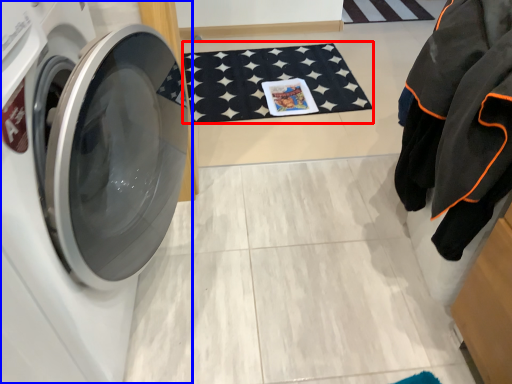
Question: Among these objects, which one is farthest to the camera, bath mat (highlighted by a red box) or washing machine (highlighted by a blue box)?

Choices:
 (A) bath mat
 (B) washing machine

Answer: (A)